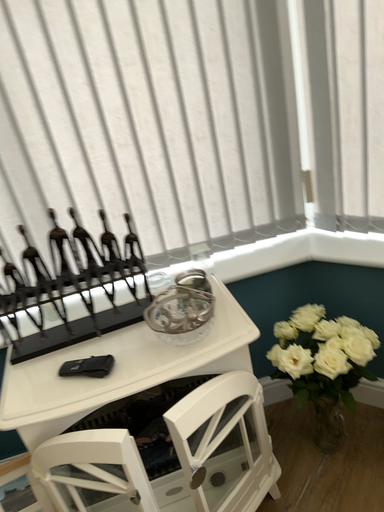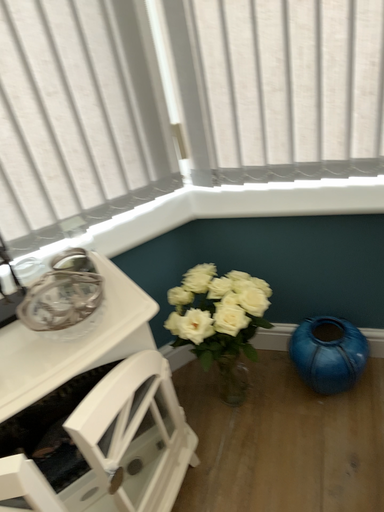
Question: Which way did the camera rotate in the video?

Choices:
 (A) rotated right
 (B) rotated left

Answer: (A)